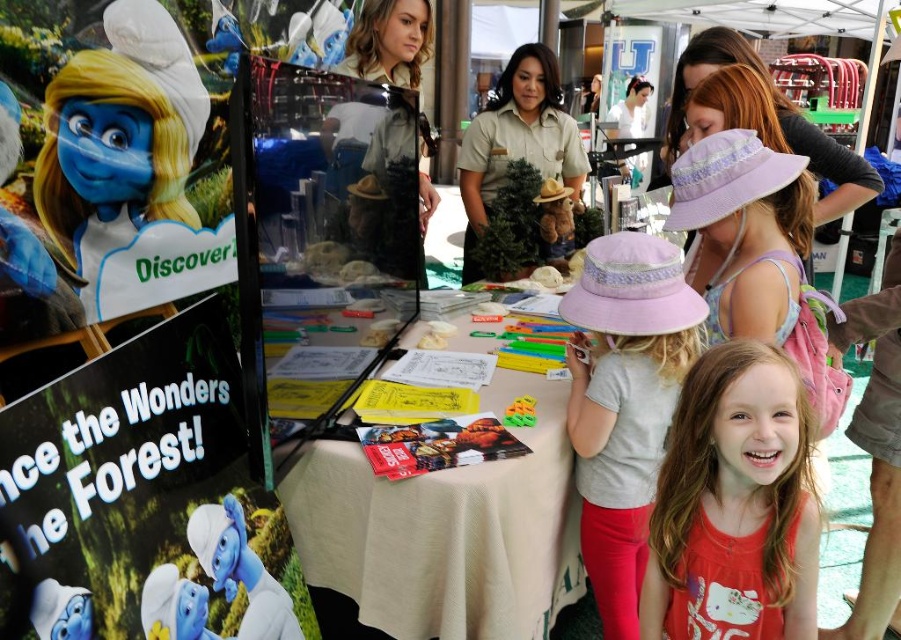
Question: Is white cloth table at center closer to the viewer compared to pink cotton shirt at lower right?

Choices:
 (A) yes
 (B) no

Answer: (B)

Question: Which is farther from the white cloth table at center?

Choices:
 (A) purple fabric hat at upper right
 (B) khaki uniform at center
 (C) pink fabric hat at upper center
 (D) matte paper poster at lower left

Answer: (B)

Question: Which object is closer to the camera taking this photo?

Choices:
 (A) pink cotton shirt at lower right
 (B) matte khaki uniform at center
 (C) purple fabric hat at upper right

Answer: (A)

Question: Where is white cloth table at center located in relation to pink cotton shirt at lower right in the image?

Choices:
 (A) above
 (B) below

Answer: (A)

Question: Based on their relative distances, which object is farther from the purple fabric hat at upper right?

Choices:
 (A) matte khaki uniform at center
 (B) white cloth table at center
 (C) matte paper poster at lower left

Answer: (C)

Question: Does white cloth table at center have a smaller size compared to pink fabric hat at upper center?

Choices:
 (A) yes
 (B) no

Answer: (B)